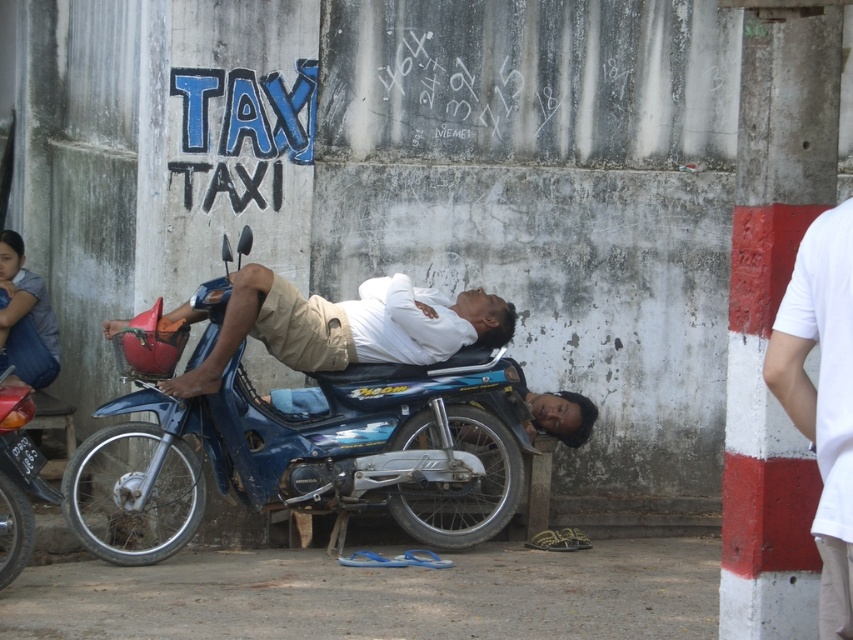
Question: Considering the real-world distances, which object is farthest from the white matte shirt at center?

Choices:
 (A) blue metallic motorcycle at center
 (B) white cotton shirt at right

Answer: (B)

Question: Can you confirm if blue metallic motorcycle at center is positioned above white matte shirt at center?

Choices:
 (A) no
 (B) yes

Answer: (A)

Question: From the image, what is the correct spatial relationship of blue metallic motorcycle at center in relation to white cotton shirt at right?

Choices:
 (A) right
 (B) left

Answer: (B)

Question: Which point appears farthest from the camera in this image?

Choices:
 (A) (285, 314)
 (B) (157, 330)

Answer: (A)

Question: Estimate the real-world distances between objects in this image. Which object is farther from the blue metallic motorcycle at center?

Choices:
 (A) white cotton shirt at right
 (B) white matte shirt at center

Answer: (A)

Question: Can you confirm if white matte shirt at center is positioned to the right of white cotton shirt at right?

Choices:
 (A) no
 (B) yes

Answer: (A)